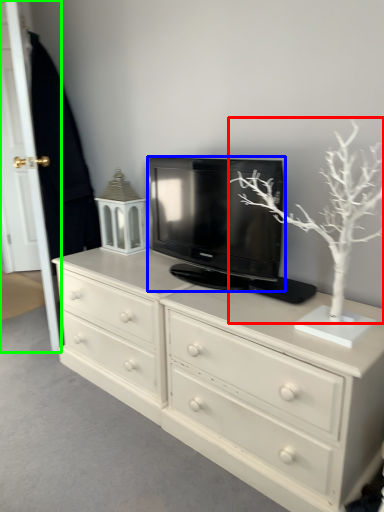
Question: Which object is the closest to the tree (highlighted by a red box)? Choose among these: television (highlighted by a blue box) or door (highlighted by a green box).

Choices:
 (A) television
 (B) door

Answer: (A)